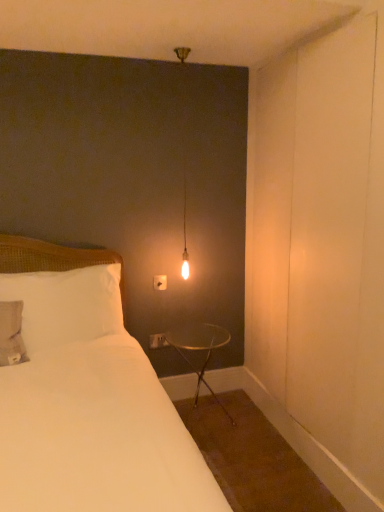
Question: Is white soft pillow at left outside white fabric bed at left?

Choices:
 (A) no
 (B) yes

Answer: (A)

Question: Does white soft pillow at left have a lesser width compared to white fabric bed at left?

Choices:
 (A) yes
 (B) no

Answer: (A)

Question: Does white soft pillow at left have a larger size compared to white fabric bed at left?

Choices:
 (A) no
 (B) yes

Answer: (A)

Question: Is white soft pillow at left to the right of white fabric bed at left from the viewer's perspective?

Choices:
 (A) no
 (B) yes

Answer: (A)

Question: Is white soft pillow at left looking in the opposite direction of white fabric bed at left?

Choices:
 (A) yes
 (B) no

Answer: (A)

Question: Does point (100, 324) appear closer or farther from the camera than point (8, 420)?

Choices:
 (A) closer
 (B) farther

Answer: (B)

Question: Is white soft pillow at left taller or shorter than white fabric bed at left?

Choices:
 (A) short
 (B) tall

Answer: (A)

Question: Based on their sizes in the image, would you say white soft pillow at left is bigger or smaller than white fabric bed at left?

Choices:
 (A) small
 (B) big

Answer: (A)

Question: From a real-world perspective, is white soft pillow at left above or below white fabric bed at left?

Choices:
 (A) below
 (B) above

Answer: (B)

Question: Considering the positions of point (155, 287) and point (1, 245), is point (155, 287) closer or farther from the camera than point (1, 245)?

Choices:
 (A) closer
 (B) farther

Answer: (B)

Question: Considering the relative positions of white plastic electric outlet at upper center and white fabric bed at left in the image provided, is white plastic electric outlet at upper center to the left or to the right of white fabric bed at left?

Choices:
 (A) left
 (B) right

Answer: (B)

Question: Based on their sizes in the image, would you say white plastic electric outlet at upper center is bigger or smaller than white fabric bed at left?

Choices:
 (A) big
 (B) small

Answer: (B)

Question: From a real-world perspective, is white plastic electric outlet at upper center positioned above or below white fabric bed at left?

Choices:
 (A) below
 (B) above

Answer: (B)

Question: In terms of width, does white soft pillow at left look wider or thinner when compared to white plastic electric outlet at upper center?

Choices:
 (A) wide
 (B) thin

Answer: (A)

Question: In the image, is white soft pillow at left positioned in front of or behind white plastic electric outlet at upper center?

Choices:
 (A) front
 (B) behind

Answer: (A)